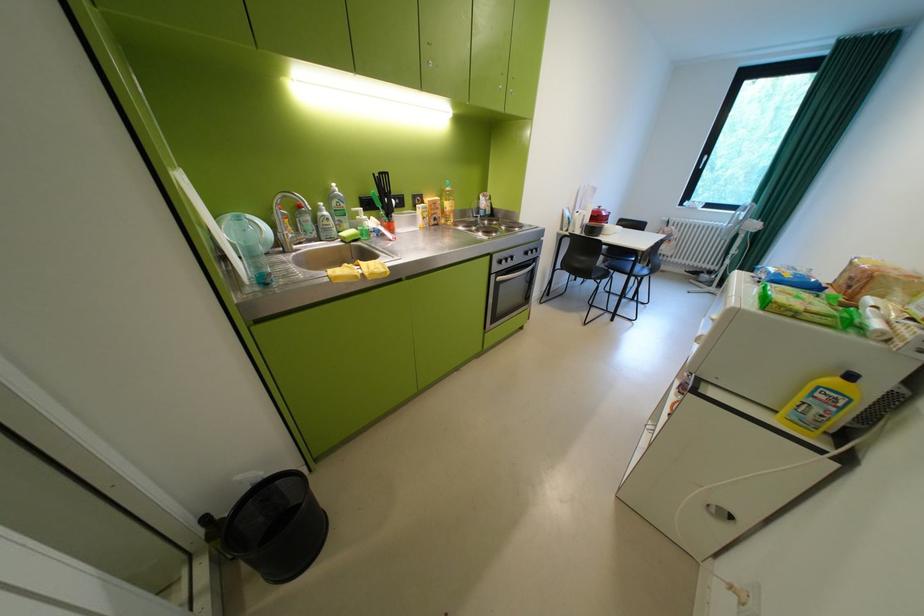
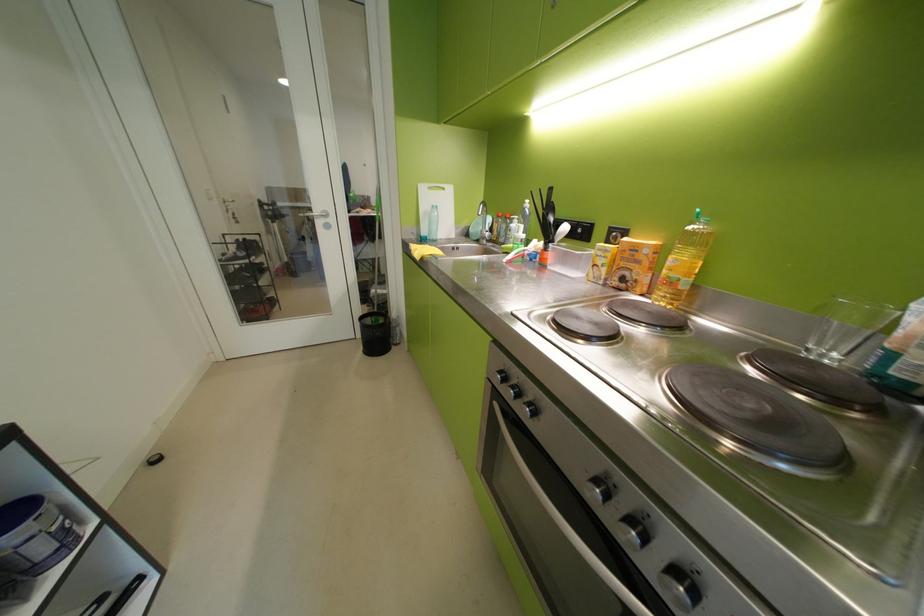
In the second image, find the point that corresponds to point (444, 204) in the first image.

(646, 249)